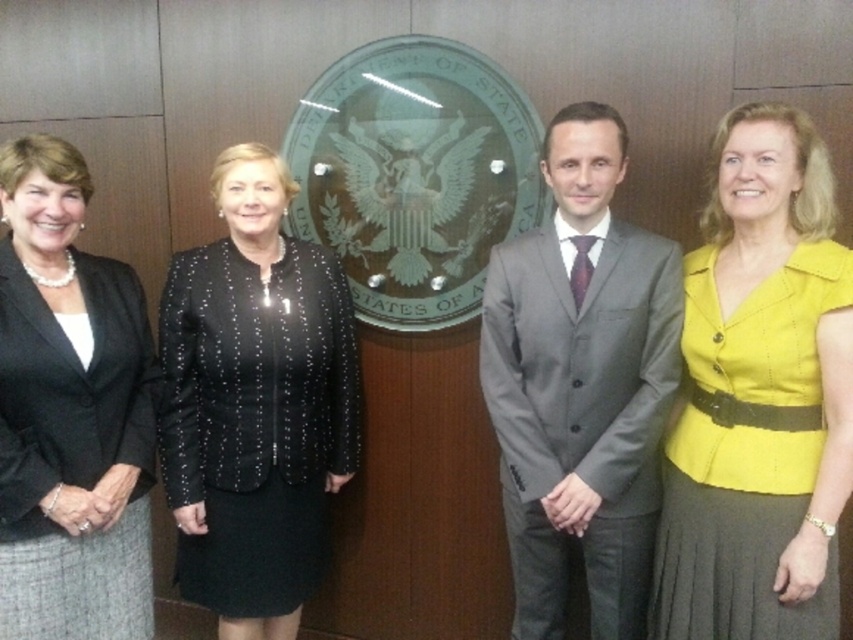
Consider the image. You are organizing a photo shoot and need to ensure that the yellow fabric dress at right and the black textured blazer at center are visible in the frame. Based on their sizes, which item might require more careful positioning to avoid being obscured?

The yellow fabric dress at right has a lesser width compared to the black textured blazer at center, so it might require more careful positioning to avoid being obscured due to its smaller size.

Looking at this image, you are a photographer adjusting your camera to focus on two points in the image. The first point is at coordinate point (x=701, y=516) and the second is at point (x=502, y=276). Which point should you focus on first to ensure proper depth of field for both points?

You should focus on point (x=701, y=516) first because it is closer to the camera than point (x=502, y=276), ensuring the depth of field captures both points effectively.

Consider the image. You are standing in front of the Department of State emblem and want to place two markers at the specified points. Which point, point (x=762, y=179) or point (x=283, y=396), is closer to you?

Point (x=762, y=179) is closer to the viewer than point (x=283, y=396).